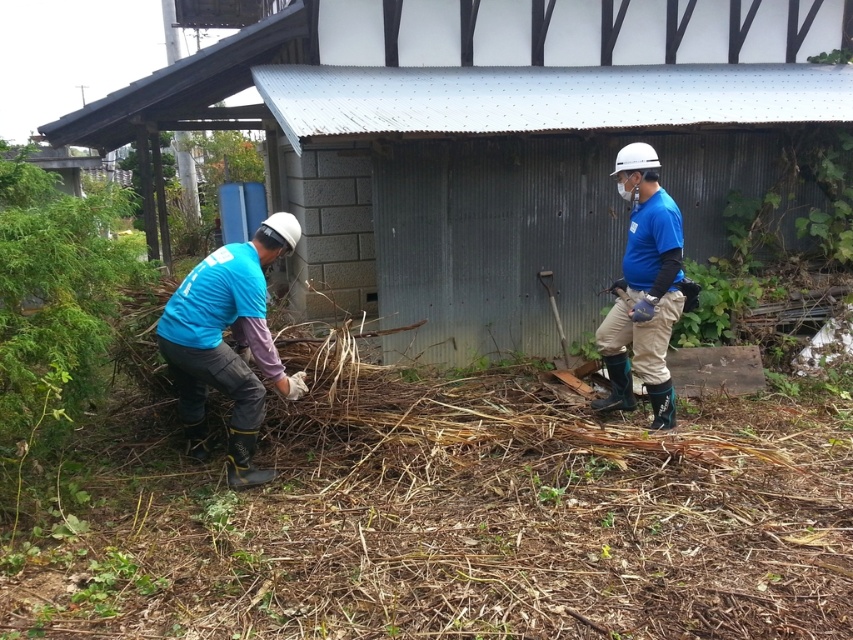
Question: Which object is the closest to the matte blue shirt at left?

Choices:
 (A) blue fabric hut at center
 (B) blue fabric shirt at right

Answer: (B)

Question: Can you confirm if blue fabric hut at center is positioned above matte blue shirt at left?

Choices:
 (A) yes
 (B) no

Answer: (A)

Question: Can you confirm if blue fabric hut at center is wider than matte blue shirt at left?

Choices:
 (A) no
 (B) yes

Answer: (B)

Question: Does matte blue shirt at left have a lesser width compared to blue fabric shirt at right?

Choices:
 (A) no
 (B) yes

Answer: (A)

Question: Which point is closer to the camera taking this photo?

Choices:
 (A) (660, 362)
 (B) (524, 163)
 (C) (259, 266)

Answer: (C)

Question: Based on their relative distances, which object is nearer to the blue fabric hut at center?

Choices:
 (A) blue fabric shirt at right
 (B) matte blue shirt at left

Answer: (A)